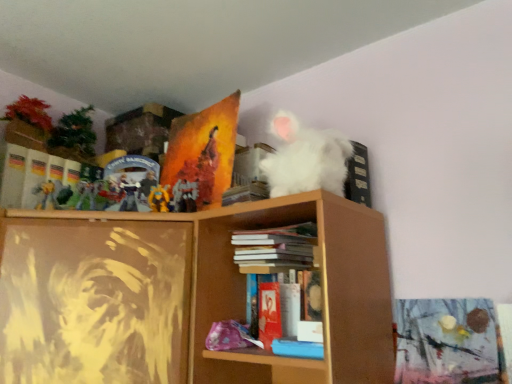
You are a GUI agent. You are given a task and a screenshot of the screen. Output one action in this format:
    pyautogui.click(x=<x>, y=<y>)
    Task: Click on the hardcover book at center, which appears as the first book when viewed from the back
    This screenshot has width=512, height=384.
    Given the screenshot: What is the action you would take?
    pyautogui.click(x=276, y=246)

Image resolution: width=512 pixels, height=384 pixels. Describe the element at coordinates (269, 313) in the screenshot. I see `matte red paperback book at center, which is the second paperback book in top-to-bottom order` at that location.

Locate an element on the screen. The height and width of the screenshot is (384, 512). matte red paperback book at center, the 1th paperback book positioned from the bottom is located at coordinates tap(269, 313).

The height and width of the screenshot is (384, 512). Identify the location of matte orange painting at upper center, placed as the second paperback book when sorted from bottom to top. (203, 152).

Looking at this image, between matte orange painting at upper center, which is the 2th paperback book in right-to-left order, and blue matte book at lower center, the 1th book positioned from the bottom, which one is positioned in front?

blue matte book at lower center, the 1th book positioned from the bottom, is in front.

Is matte orange painting at upper center, which is the 2th paperback book in right-to-left order, to the left or to the right of blue matte book at lower center, the second book viewed from the back, in the image?

In the image, matte orange painting at upper center, which is the 2th paperback book in right-to-left order, appears on the left side of blue matte book at lower center, the second book viewed from the back.

Between matte orange painting at upper center, which is counted as the 1th paperback book, starting from the back, and blue matte book at lower center, the 1th book positioned from the bottom, which one has larger size?

With larger size is matte orange painting at upper center, which is counted as the 1th paperback book, starting from the back.

Is matte orange painting at upper center, which is counted as the 1th paperback book, starting from the back, not within blue matte book at lower center, acting as the 1th book starting from the front?

matte orange painting at upper center, which is counted as the 1th paperback book, starting from the back, lies outside blue matte book at lower center, acting as the 1th book starting from the front,'s area.

Is there a large distance between matte orange painting at upper center, placed as the second paperback book when sorted from bottom to top, and matte red paperback book at center, the first paperback book from the right?

That's not correct — matte orange painting at upper center, placed as the second paperback book when sorted from bottom to top, is a little close to matte red paperback book at center, the first paperback book from the right.

How different are the orientations of matte orange painting at upper center, which is counted as the 1th paperback book, starting from the back, and matte red paperback book at center, the 1th paperback book positioned from the bottom, in degrees?

matte orange painting at upper center, which is counted as the 1th paperback book, starting from the back, and matte red paperback book at center, the 1th paperback book positioned from the bottom, are facing 17.8 degrees away from each other.

Which object is more forward, matte orange painting at upper center, which is the 2th paperback book in right-to-left order, or matte red paperback book at center, which is the second paperback book in top-to-bottom order?

matte red paperback book at center, which is the second paperback book in top-to-bottom order.

Is metallic gold action figure at upper center inside or outside of blue matte book at lower center, which appears as the 2th book when viewed from the top?

metallic gold action figure at upper center is not enclosed by blue matte book at lower center, which appears as the 2th book when viewed from the top.

Find the location of `book that is the 2nd one when counting forward from the metallic gold action figure at upper center`. book that is the 2nd one when counting forward from the metallic gold action figure at upper center is located at coordinates (297, 348).

In terms of height, does metallic gold action figure at upper center look taller or shorter compared to blue matte book at lower center, the 1th book positioned from the bottom?

Clearly, metallic gold action figure at upper center is taller compared to blue matte book at lower center, the 1th book positioned from the bottom.

From a real-world perspective, is metallic gold action figure at upper center physically below blue matte book at lower center, which appears as the 2th book when viewed from the top?

Incorrect, from a real-world perspective, metallic gold action figure at upper center is higher than blue matte book at lower center, which appears as the 2th book when viewed from the top.

Is matte red paperback book at center, which is the second paperback book in top-to-bottom order, spatially inside hardcover book at center, which appears as the first book when viewed from the back, or outside of it?

matte red paperback book at center, which is the second paperback book in top-to-bottom order, is outside hardcover book at center, which appears as the first book when viewed from the back.

Considering the relative sizes of matte red paperback book at center, the second paperback book viewed from the left, and hardcover book at center, the 1th book from the top, in the image provided, is matte red paperback book at center, the second paperback book viewed from the left, smaller than hardcover book at center, the 1th book from the top,?

Indeed, matte red paperback book at center, the second paperback book viewed from the left, has a smaller size compared to hardcover book at center, the 1th book from the top.

From a real-world perspective, which is physically above, matte red paperback book at center, the first paperback book from the right, or hardcover book at center, the 1th book from the top?

hardcover book at center, the 1th book from the top.

Based on the photo, how distant is matte red paperback book at center, the 1th paperback book positioned from the bottom, from hardcover book at center, which appears as the first book when viewed from the back?

A distance of 4.57 inches exists between matte red paperback book at center, the 1th paperback book positioned from the bottom, and hardcover book at center, which appears as the first book when viewed from the back.

From a real-world perspective, which is physically below, hardcover book at center, the second book ordered from the bottom, or metallic gold action figure at upper center?

hardcover book at center, the second book ordered from the bottom, from a real-world perspective.

Is hardcover book at center, which appears as the first book when viewed from the back, inside or outside of metallic gold action figure at upper center?

hardcover book at center, which appears as the first book when viewed from the back, lies outside metallic gold action figure at upper center.

How distant is hardcover book at center, positioned as the 2th book in front-to-back order, from metallic gold action figure at upper center?

hardcover book at center, positioned as the 2th book in front-to-back order, is 12.08 inches away from metallic gold action figure at upper center.

From a real-world perspective, is matte orange painting at upper center, the 1th paperback book when ordered from left to right, positioned over hardcover book at center, positioned as the 2th book in front-to-back order, based on gravity?

Correct, in the physical world, matte orange painting at upper center, the 1th paperback book when ordered from left to right, is higher than hardcover book at center, positioned as the 2th book in front-to-back order.

How different are the orientations of matte orange painting at upper center, which is counted as the 1th paperback book, starting from the back, and hardcover book at center, the second book ordered from the bottom, in degrees?

The facing directions of matte orange painting at upper center, which is counted as the 1th paperback book, starting from the back, and hardcover book at center, the second book ordered from the bottom, are 4.01 degrees apart.

Is matte orange painting at upper center, which is counted as the 1th paperback book, starting from the back, oriented towards hardcover book at center, the 1th book from the top?

No, matte orange painting at upper center, which is counted as the 1th paperback book, starting from the back, is not oriented towards hardcover book at center, the 1th book from the top.

From the matte orange painting at upper center, marked as the 2th paperback book in a front-to-back arrangement, count 1st books forward and point to it. Please provide its 2D coordinates.

[(276, 246)]

From the image's perspective, between matte orange painting at upper center, marked as the 2th paperback book in a front-to-back arrangement, and metallic gold action figure at upper center, which one is located above?

matte orange painting at upper center, marked as the 2th paperback book in a front-to-back arrangement, appears higher in the image.

Is point (174, 131) closer or farther from the camera than point (167, 197)?

Point (174, 131) appears to be farther away from the viewer than point (167, 197).

Measure the distance from matte orange painting at upper center, placed as the second paperback book when sorted from bottom to top, to metallic gold action figure at upper center.

matte orange painting at upper center, placed as the second paperback book when sorted from bottom to top, and metallic gold action figure at upper center are 8.31 inches apart.

Consider the image. Considering the relative positions of matte orange painting at upper center, placed as the second paperback book when sorted from bottom to top, and metallic gold action figure at upper center in the image provided, is matte orange painting at upper center, placed as the second paperback book when sorted from bottom to top, behind metallic gold action figure at upper center?

That is False.

In order to click on the 2nd book in front of the matte orange painting at upper center, which is counted as the 1th paperback book, starting from the back, starting your count from the anchor in this screenshot , I will do `click(297, 348)`.

What are the coordinates of `paperback book behind the matte red paperback book at center, the 1th paperback book positioned from the bottom` in the screenshot? It's located at (203, 152).

When comparing their distances from matte red paperback book at center, the second paperback book viewed from the left, does metallic gold action figure at upper center or blue matte book at lower center, the second book viewed from the back, seem closer?

The object closer to matte red paperback book at center, the second paperback book viewed from the left, is blue matte book at lower center, the second book viewed from the back.

From the picture: Which object lies further to the anchor point hardcover book at center, the 1th book from the top, matte orange painting at upper center, placed as the second paperback book when sorted from bottom to top, or metallic gold action figure at upper center?

metallic gold action figure at upper center.

Estimate the real-world distances between objects in this image. Which object is closer to metallic gold action figure at upper center, blue matte book at lower center, acting as the 1th book starting from the front, or matte red paperback book at center, the first paperback book from the right?

matte red paperback book at center, the first paperback book from the right, lies closer to metallic gold action figure at upper center than the other object.

Considering their positions, is hardcover book at center, the 1th book from the top, positioned closer to matte red paperback book at center, the first paperback book from the right, than metallic gold action figure at upper center?

hardcover book at center, the 1th book from the top, is positioned closer to the anchor matte red paperback book at center, the first paperback book from the right.

Based on the photo, based on their spatial positions, is matte orange painting at upper center, which is the 2th paperback book in right-to-left order, or metallic gold action figure at upper center closer to matte red paperback book at center, which is the second paperback book in top-to-bottom order?

metallic gold action figure at upper center.

When comparing their distances from matte orange painting at upper center, placed as the second paperback book when sorted from bottom to top, does matte red paperback book at center, the 1th paperback book positioned from the bottom, or hardcover book at center, positioned as the 2th book in front-to-back order, seem further?

matte red paperback book at center, the 1th paperback book positioned from the bottom, is positioned further to the anchor matte orange painting at upper center, placed as the second paperback book when sorted from bottom to top.

From the image, which object appears to be farther from matte orange painting at upper center, which is counted as the 1th paperback book, starting from the back, matte red paperback book at center, the first paperback book from the right, or blue matte book at lower center, acting as the 1th book starting from the front?

blue matte book at lower center, acting as the 1th book starting from the front, is positioned further to the anchor matte orange painting at upper center, which is counted as the 1th paperback book, starting from the back.

When comparing their distances from matte orange painting at upper center, which is the 2th paperback book in right-to-left order, does blue matte book at lower center, acting as the 1th book starting from the front, or hardcover book at center, the 1th book from the top, seem closer?

hardcover book at center, the 1th book from the top, is positioned closer to the anchor matte orange painting at upper center, which is the 2th paperback book in right-to-left order.

Find the location of a particular element. paperback book between matte orange painting at upper center, which is counted as the 1th paperback book, starting from the back, and blue matte book at lower center, acting as the 1th book starting from the front, in the vertical direction is located at coordinates (269, 313).

This screenshot has height=384, width=512. In order to click on book that lies between matte orange painting at upper center, the 1th paperback book when ordered from left to right, and blue matte book at lower center, acting as the 1th book starting from the front, from top to bottom in this screenshot , I will do `click(276, 246)`.

Locate an element on the screen. Image resolution: width=512 pixels, height=384 pixels. toy between matte orange painting at upper center, which is counted as the 1th paperback book, starting from the back, and blue matte book at lower center, the 1th book positioned from the bottom, in the up-down direction is located at coordinates (159, 198).

Identify the location of toy that lies between matte orange painting at upper center, marked as the 2th paperback book in a front-to-back arrangement, and matte red paperback book at center, the second paperback book viewed from the left, from top to bottom. (159, 198).